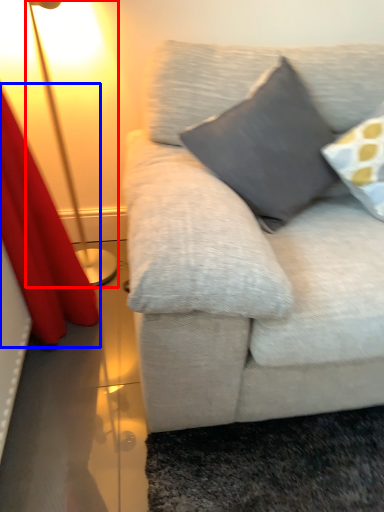
Question: Which object is further to the camera taking this photo, lamp (highlighted by a red box) or curtain (highlighted by a blue box)?

Choices:
 (A) lamp
 (B) curtain

Answer: (A)